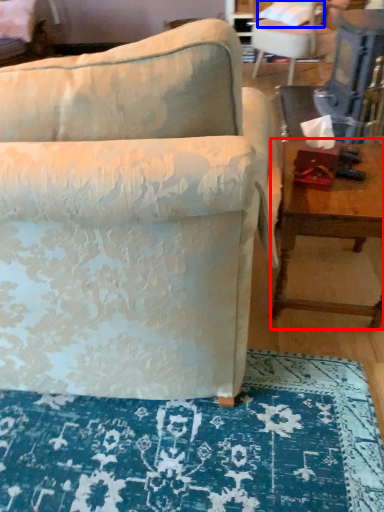
Question: Which of the following is the farthest to the observer, table (highlighted by a red box) or pillow (highlighted by a blue box)?

Choices:
 (A) table
 (B) pillow

Answer: (B)